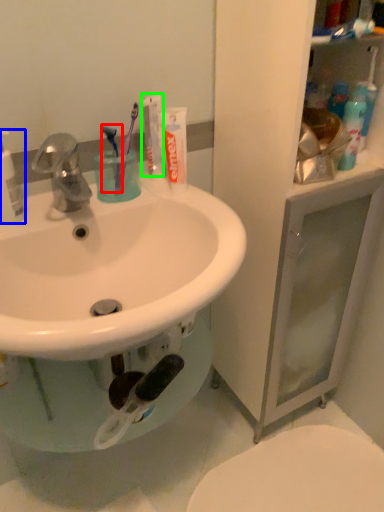
Question: Estimate the real-world distances between objects in this image. Which object is farther from toothbrush (highlighted by a red box), cleaning product (highlighted by a blue box) or toothpaste (highlighted by a green box)?

Choices:
 (A) cleaning product
 (B) toothpaste

Answer: (A)